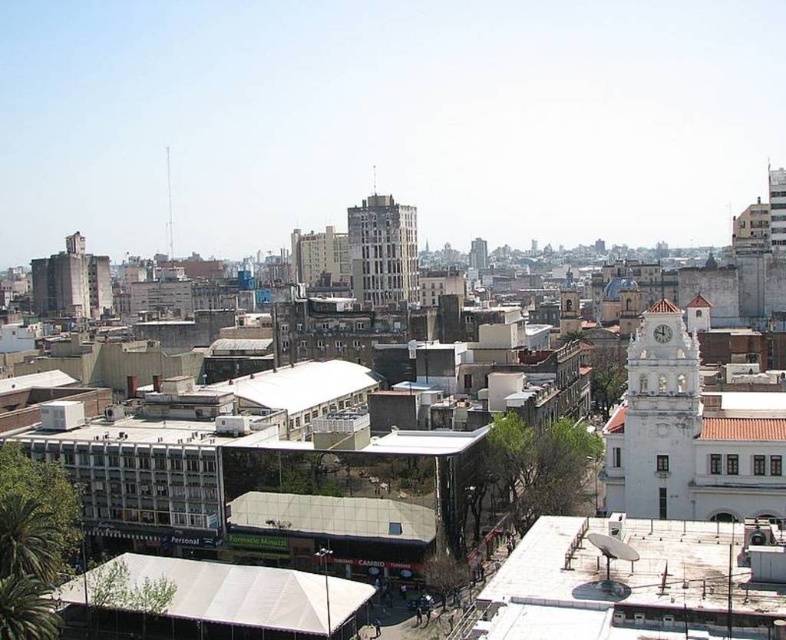
Question: Which of these objects is positioned farthest from the white marble clock at center-right?

Choices:
 (A) white stone clock tower at center-right
 (B) gray concrete building at center

Answer: (B)

Question: Observing the image, what is the correct spatial positioning of white stone clock tower at center-right in reference to white marble clock at center-right?

Choices:
 (A) below
 (B) above

Answer: (A)

Question: Which object is the closest to the gray concrete building at center?

Choices:
 (A) white stone clock tower at center-right
 (B) white marble clock at center-right

Answer: (A)

Question: Which point is closer to the camera?

Choices:
 (A) (656, 336)
 (B) (660, 515)
 (C) (410, 212)

Answer: (B)

Question: Can you confirm if white stone clock tower at center-right is smaller than white marble clock at center-right?

Choices:
 (A) yes
 (B) no

Answer: (B)

Question: Does white stone clock tower at center-right have a larger size compared to white marble clock at center-right?

Choices:
 (A) no
 (B) yes

Answer: (B)